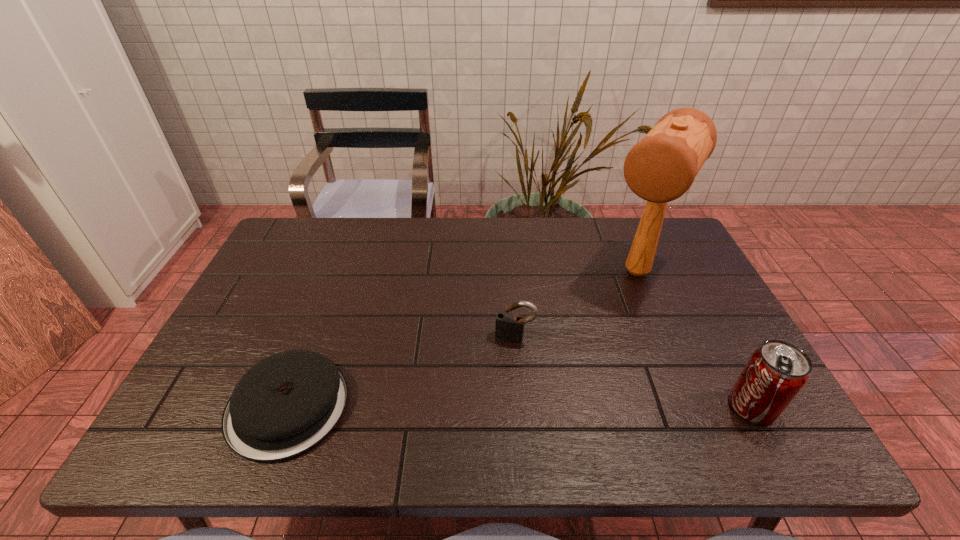
At what (x,y) coordinates should I click in order to perform the action: click on vacant space at the near right corner of the desktop. Please return your answer as a coordinate pair (x, y). This screenshot has height=540, width=960. Looking at the image, I should click on (731, 413).

This screenshot has width=960, height=540. In order to click on vacant area that lies between the leftmost object and the farthest object in this screenshot , I will do `click(463, 339)`.

Locate an element on the screen. vacant space that's between the third tallest object and the pop soda is located at coordinates (634, 372).

Locate an element on the screen. vacant point located between the padlock and the pancake is located at coordinates (401, 372).

Find the location of a particular element. free area in between the padlock and the pop soda is located at coordinates (634, 372).

Identify the location of free spot between the farthest object and the pancake. coord(463,339).

At what (x,y) coordinates should I click in order to perform the action: click on unoccupied area between the leftmost object and the pop soda. Please return your answer as a coordinate pair (x, y). This screenshot has height=540, width=960. Looking at the image, I should click on (520, 407).

What are the coordinates of `vacant point located between the leftmost object and the mallet` in the screenshot? It's located at (463, 339).

The width and height of the screenshot is (960, 540). What are the coordinates of `blank region between the padlock and the tallest object` in the screenshot? It's located at point(576,305).

This screenshot has height=540, width=960. Identify the location of free space between the second shortest object and the farthest object. (576, 305).